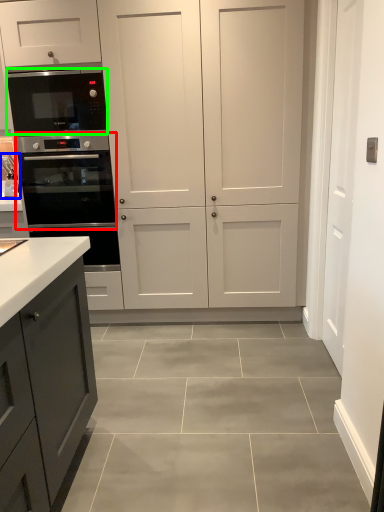
Question: Which is farther away from oven (highlighted by a red box)? sink (highlighted by a blue box) or microwave oven (highlighted by a green box)?

Choices:
 (A) sink
 (B) microwave oven

Answer: (A)